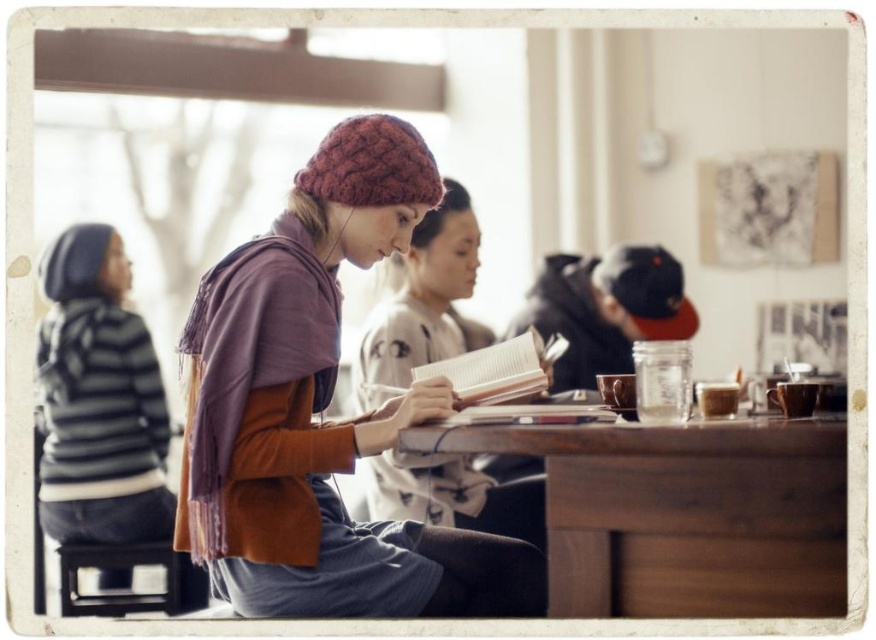
You are a customer in the cafe and want to place your laptop on the table. The table has a dark brown wooden stool at lower left and a white paper book at center. Which object should you move to make space for your laptop?

You should move the dark brown wooden stool at lower left because it is positioned on the left side of the white paper book at center, so moving it would create space for the laptop.